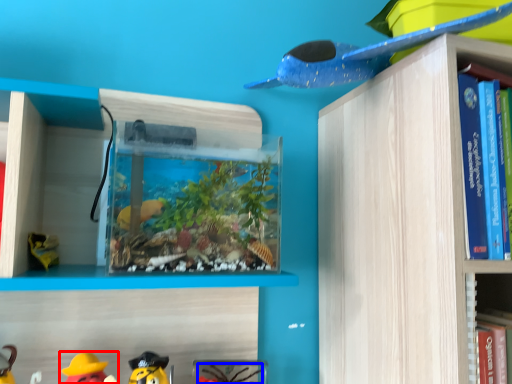
Question: Which object is further to the camera taking this photo, toy (highlighted by a red box) or toy (highlighted by a blue box)?

Choices:
 (A) toy
 (B) toy

Answer: (B)